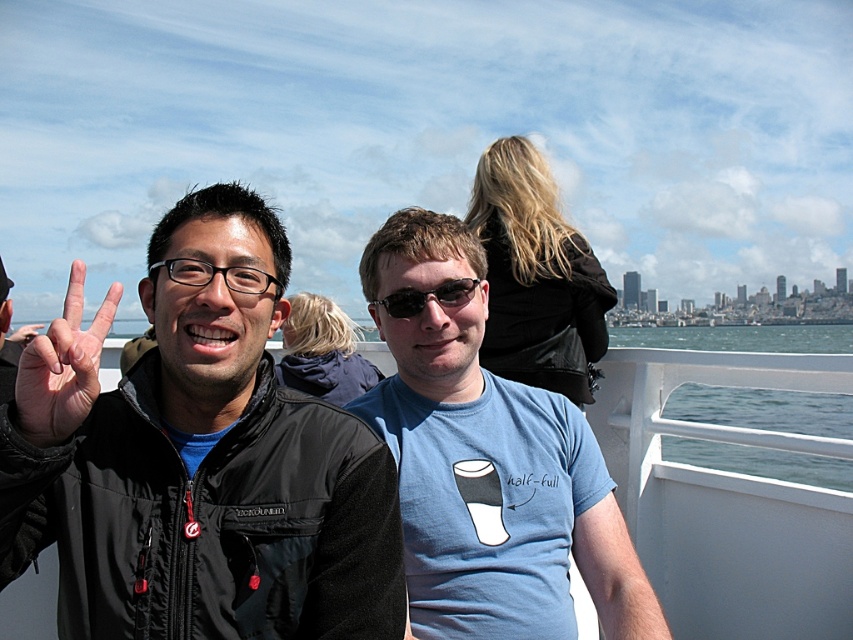
Looking at this image, is black matte jacket at left smaller than blue cotton t-shirt at center?

No, black matte jacket at left is not smaller than blue cotton t-shirt at center.

Is point (86, 436) less distant than point (558, 589)?

Yes, it is.

Who is more forward, (x=247, y=632) or (x=428, y=394)?

Positioned in front is point (x=247, y=632).

What are the coordinates of `black matte jacket at left` in the screenshot? It's located at (195, 481).

Is black matte jacket at left in front of blue water at lower right?

Yes, black matte jacket at left is closer to the viewer.

What do you see at coordinates (195, 481) in the screenshot?
I see `black matte jacket at left` at bounding box center [195, 481].

Where is `black matte jacket at left`? black matte jacket at left is located at coordinates (195, 481).

Looking at this image, does skinny-fingered hand at left appear on the left side of black plastic glasses at upper center?

Yes, skinny-fingered hand at left is to the left of black plastic glasses at upper center.

Who is positioned more to the right, skinny-fingered hand at left or black plastic glasses at upper center?

From the viewer's perspective, black plastic glasses at upper center appears more on the right side.

The width and height of the screenshot is (853, 640). In order to click on skinny-fingered hand at left in this screenshot , I will do `click(62, 365)`.

The width and height of the screenshot is (853, 640). I want to click on skinny-fingered hand at left, so click(62, 365).